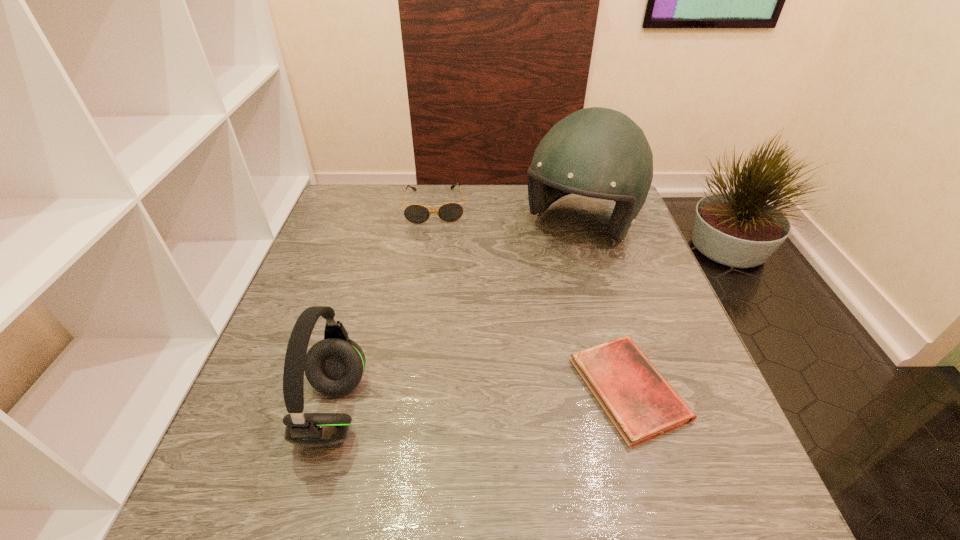
Where is `object that is at the far right corner`? object that is at the far right corner is located at coordinates (x=596, y=152).

Image resolution: width=960 pixels, height=540 pixels. I want to click on object that is at the near right corner, so (641, 404).

Identify the location of blank space at the far edge. (484, 201).

Where is `vacant space at the left edge of the desktop`? vacant space at the left edge of the desktop is located at coordinates (356, 309).

Identify the location of vacant region at the right edge of the desktop. [599, 269].

Find the location of a particular element. This screenshot has height=540, width=960. free spot at the far left corner of the desktop is located at coordinates (340, 207).

Where is `vacant space at the near left corner of the desktop`? vacant space at the near left corner of the desktop is located at coordinates (258, 443).

The width and height of the screenshot is (960, 540). Find the location of `vacant region at the far right corner of the desktop`. vacant region at the far right corner of the desktop is located at coordinates (581, 222).

The height and width of the screenshot is (540, 960). What are the coordinates of `free space between the tallest object and the diary` in the screenshot? It's located at (604, 308).

Where is `empty location between the sunglasses and the headset`? empty location between the sunglasses and the headset is located at coordinates (385, 308).